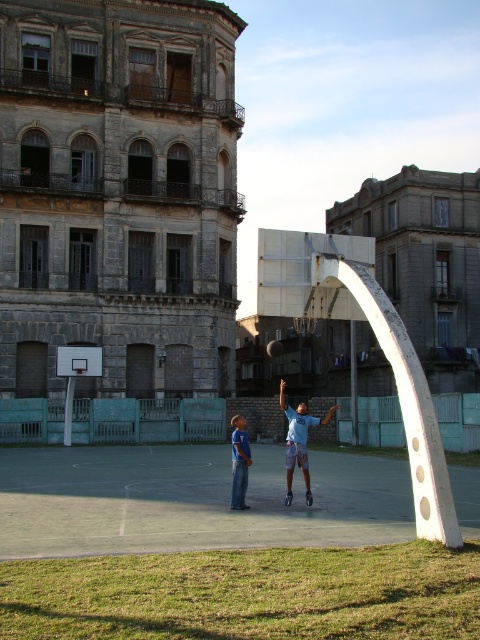
You are a photographer standing on the basketball court. You want to capture a photo of the blue cotton shirt at center and the smooth concrete court at center. Which object is positioned lower in the frame?

The smooth concrete court at center is located below the blue cotton shirt at center, so it is positioned lower in the frame.

Consider the image. You are standing at the center of the basketball court and want to throw a ball to the light blue jersey at center located at point (299, 442). Is the ball likely to pass over the low teal fence surrounding the court?

The light blue jersey at center is located at point (299, 442), which is within the basketball court enclosed by the low teal fence. Since the fence surrounds the court, the ball thrown to that point would stay within the court and not go over the fence.